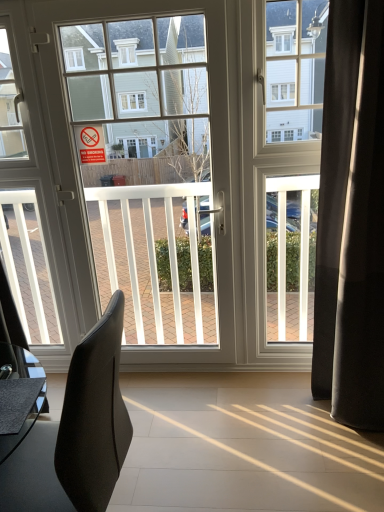
Where is `vacant space in front of white glossy door at center`? Image resolution: width=384 pixels, height=512 pixels. vacant space in front of white glossy door at center is located at coordinates (177, 423).